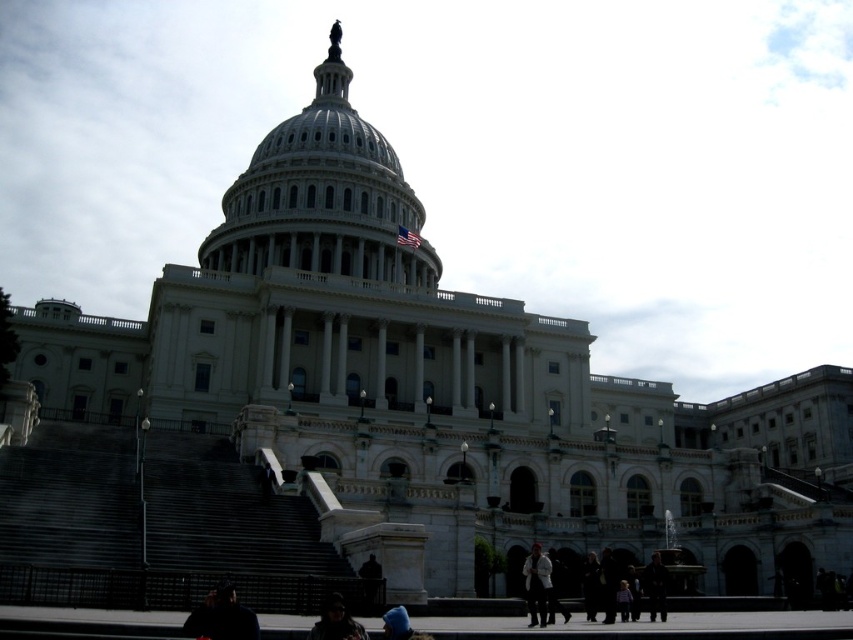
Question: Is matte black jacket at lower center to the right of dark clothing at lower center from the viewer's perspective?

Choices:
 (A) no
 (B) yes

Answer: (A)

Question: Among these points, which one is nearest to the camera?

Choices:
 (A) (595, 570)
 (B) (328, 598)
 (C) (354, 259)

Answer: (B)

Question: Observing the image, what is the correct spatial positioning of dark gray stone stairs at lower left in reference to light gray fabric jacket at lower center?

Choices:
 (A) left
 (B) right

Answer: (A)

Question: Which point is farther to the camera?

Choices:
 (A) (300, 214)
 (B) (540, 570)
 (C) (657, 586)

Answer: (A)

Question: Which is farther from the dark fabric jacket at lower left?

Choices:
 (A) dark clothing at lower center
 (B) matte black jacket at lower center
 (C) dark gray stone stairs at lower left

Answer: (A)

Question: In this image, where is dark fabric jacket at lower left located relative to dark clothing at lower center?

Choices:
 (A) below
 (B) above

Answer: (B)